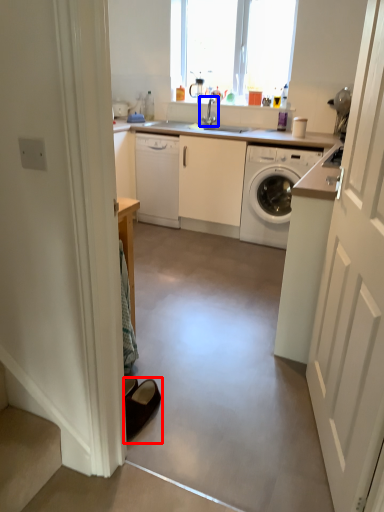
Question: Which object appears farthest to the camera in this image, footwear (highlighted by a red box) or tap (highlighted by a blue box)?

Choices:
 (A) footwear
 (B) tap

Answer: (B)